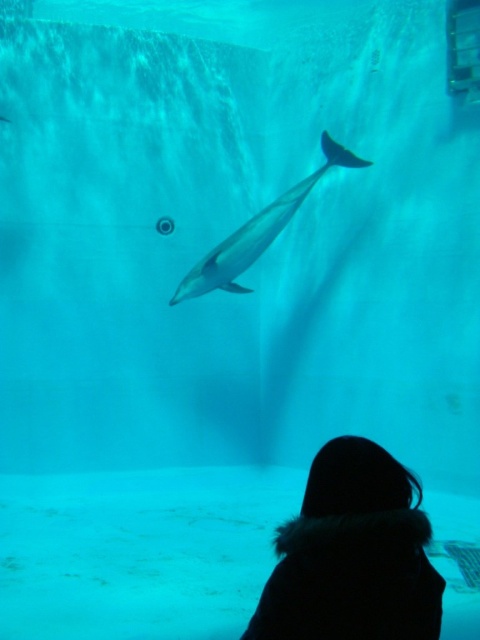
Does black fur coat at lower center appear under smooth gray dolphin at center?

Yes.

Does black fur coat at lower center appear on the right side of smooth gray dolphin at center?

Correct, you'll find black fur coat at lower center to the right of smooth gray dolphin at center.

Between point (313, 582) and point (187, 296), which one is positioned in front?

Positioned in front is point (313, 582).

This screenshot has width=480, height=640. I want to click on black fur coat at lower center, so click(352, 554).